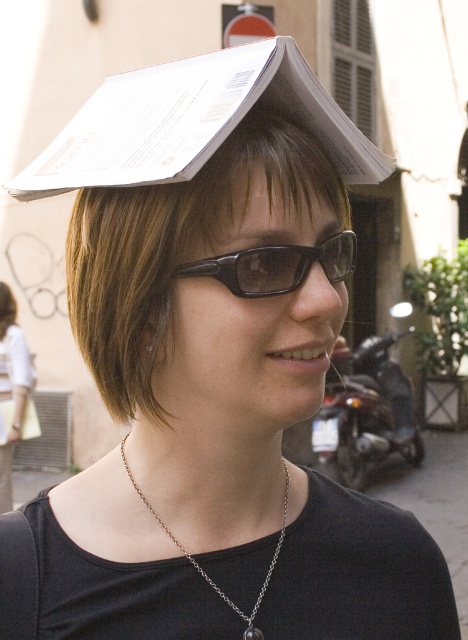
The height and width of the screenshot is (640, 468). Describe the element at coordinates (276, 266) in the screenshot. I see `black plastic glasses at center` at that location.

Image resolution: width=468 pixels, height=640 pixels. I want to click on black plastic glasses at center, so click(x=276, y=266).

Which of these two, brown smooth hair at upper center or black plastic glasses at center, stands shorter?

black plastic glasses at center

Which is in front, point (168, 230) or point (292, 246)?

Positioned in front is point (292, 246).

Find the location of a particular element. The height and width of the screenshot is (640, 468). brown smooth hair at upper center is located at coordinates (170, 248).

Can you confirm if brown smooth hair at upper center is thinner than silver chain necklace at center?

In fact, brown smooth hair at upper center might be wider than silver chain necklace at center.

Between brown smooth hair at upper center and silver chain necklace at center, which one is positioned lower?

silver chain necklace at center is lower down.

Between point (124, 253) and point (129, 477), which one is positioned behind?

Positioned behind is point (129, 477).

I want to click on brown smooth hair at upper center, so click(x=170, y=248).